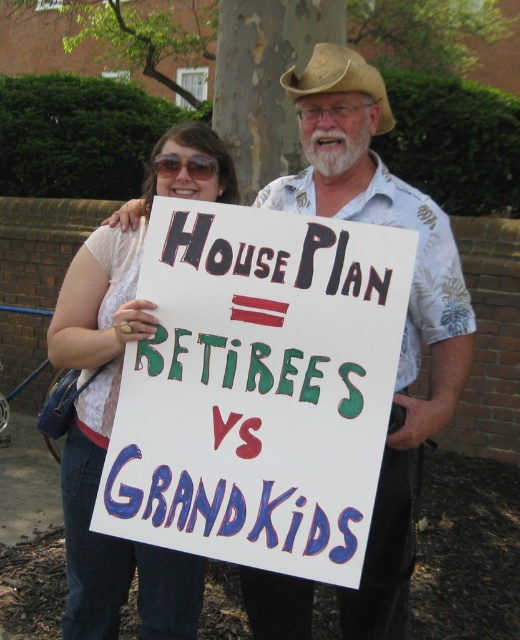
You are a photographer trying to capture the sign held by the two people in the image. The sign has a specific point marked at coordinates point (115, 404). Where is this point located on the image?

The point (115, 404) is on the white lace shirt at upper left.

You are a photographer trying to capture a candid shot of the two people holding the sign. To avoid blocking the sign, you need to position yourself so that you can see both the white floral shirt at center and the tan straw cowboy hat at upper center clearly. Which object should you focus on first to ensure both are in frame?

The tan straw cowboy hat at upper center is above the white floral shirt at center. Focus on the tan straw cowboy hat at upper center first to ensure both are in frame since it is higher up, allowing the lower shirt to still be visible in the shot.